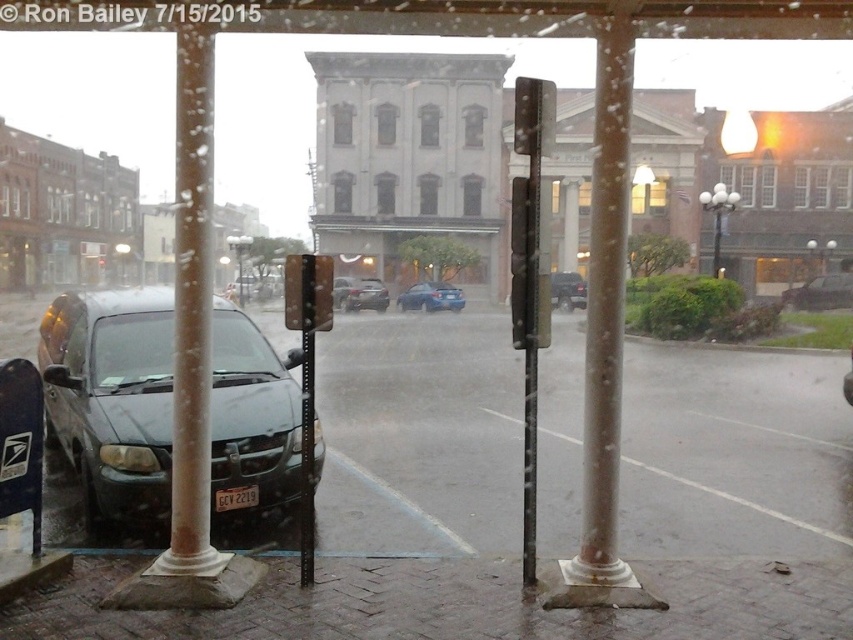
Question: Can you confirm if satin gold column at center is bigger than matte black suv at center?

Choices:
 (A) yes
 (B) no

Answer: (B)

Question: Which object appears farthest from the camera in this image?

Choices:
 (A) satin gold column at center
 (B) metallic gray streetlight at upper center
 (C) white glass lamp post at upper right
 (D) matte black lamp post at upper center

Answer: (D)

Question: Where is matte black suv at center located in relation to metallic gray streetlight at upper center in the image?

Choices:
 (A) right
 (B) left

Answer: (A)

Question: Is white marble pole at left bigger than metallic gray streetlight at upper center?

Choices:
 (A) no
 (B) yes

Answer: (A)

Question: Which object appears farthest from the camera in this image?

Choices:
 (A) metallic rectangular traffic light at left
 (B) white marble pole at left
 (C) metallic silver streetlight at upper right
 (D) matte black lamp post at upper center

Answer: (D)

Question: Estimate the real-world distances between objects in this image. Which object is closer to the matte black lamp post at upper center?

Choices:
 (A) satin gold column at center
 (B) matte black sedan at left
 (C) metallic silver streetlight at upper right
 (D) blue metallic sedan at center

Answer: (D)